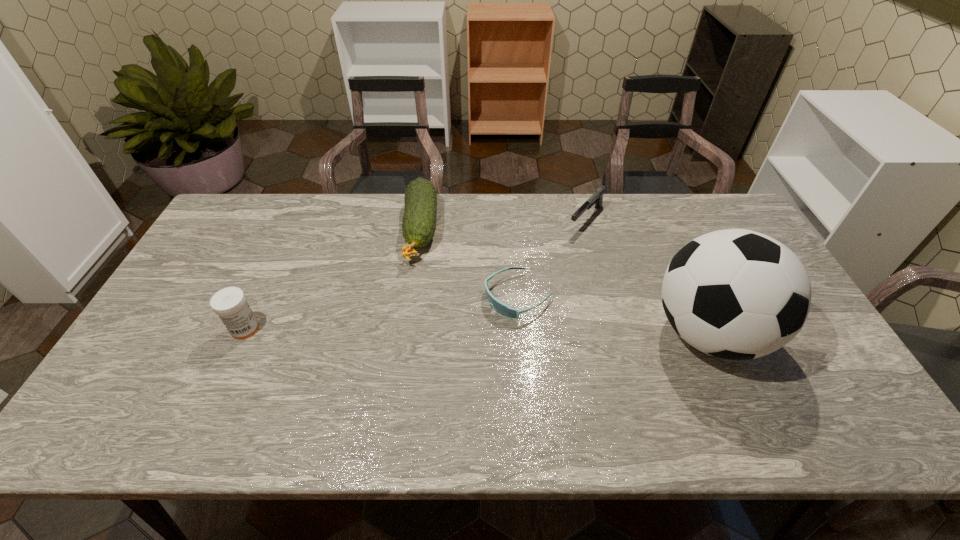
Identify the location of medicine. Image resolution: width=960 pixels, height=540 pixels. (230, 304).

You are a GUI agent. You are given a task and a screenshot of the screen. Output one action in this format:
    pyautogui.click(x=<x>, y=<y>)
    Task: Click on the rightmost object
    The image size is (960, 540).
    Given the screenshot: What is the action you would take?
    pyautogui.click(x=737, y=294)

In order to click on the tallest object in this screenshot , I will do `click(737, 294)`.

You are a GUI agent. You are given a task and a screenshot of the screen. Output one action in this format:
    pyautogui.click(x=<x>, y=<y>)
    Task: Click on the second shortest object
    Image resolution: width=960 pixels, height=540 pixels.
    Given the screenshot: What is the action you would take?
    pyautogui.click(x=597, y=198)

The width and height of the screenshot is (960, 540). I want to click on gun, so click(597, 198).

At what (x,y) coordinates should I click in order to perform the action: click on goggles. Please return your answer as a coordinate pair (x, y). The width and height of the screenshot is (960, 540). Looking at the image, I should click on (502, 309).

Identify the location of the third object from left to right. The width and height of the screenshot is (960, 540). (502, 309).

This screenshot has height=540, width=960. What are the coordinates of `cucumber` in the screenshot? It's located at (419, 222).

Where is `the second object from left to right`? This screenshot has height=540, width=960. the second object from left to right is located at coordinates (419, 222).

Locate an element on the screen. This screenshot has height=540, width=960. free point located 0.150m on the right of the leftmost object is located at coordinates (316, 329).